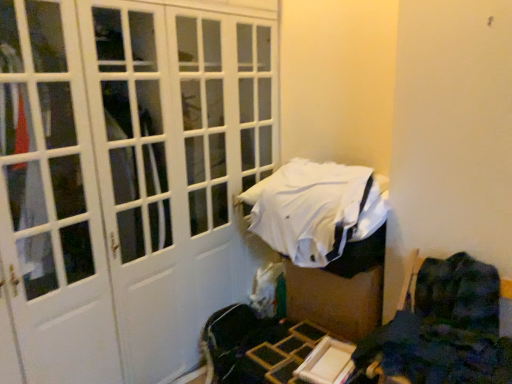
Question: Considering their positions, is dark blue fabric chair at lower right located in front of or behind white matte door at center?

Choices:
 (A) front
 (B) behind

Answer: (B)

Question: Considering the positions of dark blue fabric chair at lower right and white matte door at center in the image, is dark blue fabric chair at lower right wider or thinner than white matte door at center?

Choices:
 (A) wide
 (B) thin

Answer: (B)

Question: Estimate the real-world distances between objects in this image. Which object is farther from the white matte door at center?

Choices:
 (A) white fabric bed at center
 (B) dark blue fabric chair at lower right

Answer: (B)

Question: Which object is the farthest from the dark blue fabric chair at lower right?

Choices:
 (A) white fabric bed at center
 (B) white matte door at center

Answer: (B)